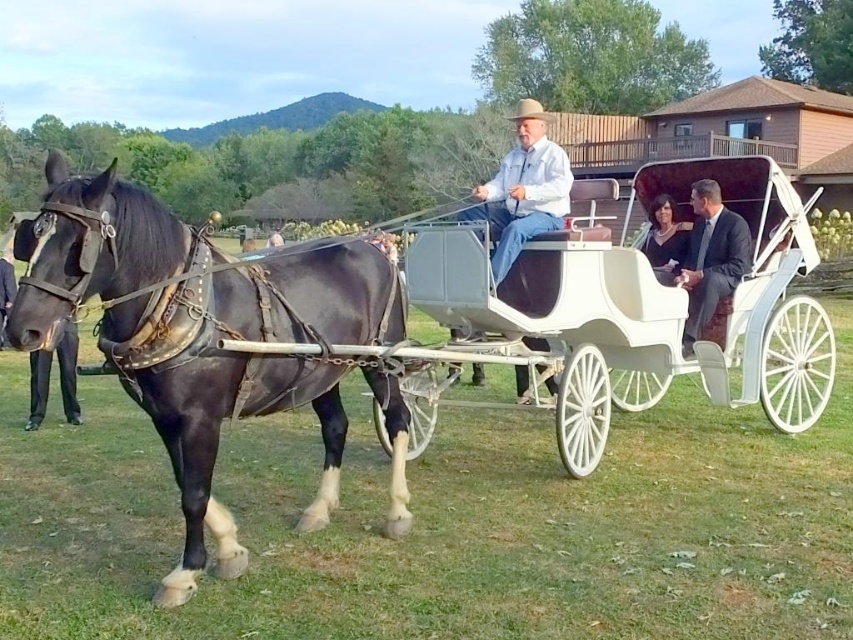
You are standing at the position of the viewer and want to pick up the light brown leather hat at center. Is it within your immediate reach without moving your feet?

The light brown leather hat at center is 4.63 meters away from the viewer, which is too far to reach without moving your feet.

You are standing in the middle of the field and see the point marked at coordinates (201, 332). What object is located at that point?

The point at coordinates (201, 332) indicates the shiny black horse at left.

You are a photographer planning to take a photo of the shiny black horse at left and the dark gray suit at center in this scene. Since you want both subjects to appear balanced in size in the final image, which subject should you move closer to the camera?

You should move the shiny black horse at left closer to the camera because it is smaller in size compared to the dark gray suit at center, so moving it closer will make it appear larger in the photo and balance the sizes.